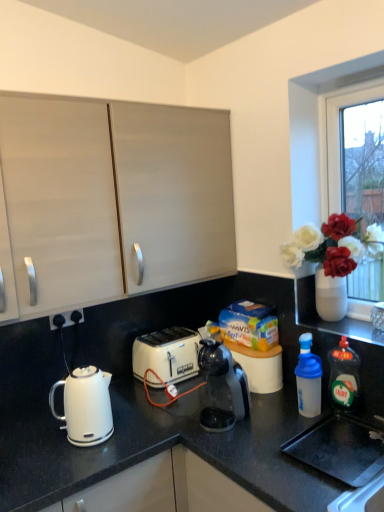
Locate an element on the screen. Image resolution: width=384 pixels, height=512 pixels. vacant point to the right of white glossy kettle at left is located at coordinates (137, 438).